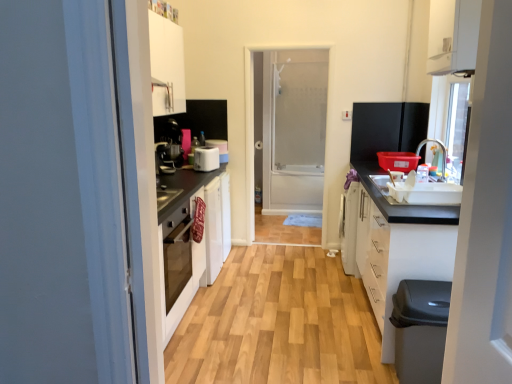
What is the approximate height of wooden floor at center?

2.78 centimeters.

How much space does white matte cabinet at lower right, which appears as the first cabinetry when ordered from the bottom, occupy vertically?

37.04 inches.

What is the approximate width of transparent glass screen door at center?

The width of transparent glass screen door at center is 7.07 inches.

The image size is (512, 384). Describe the element at coordinates (420, 329) in the screenshot. I see `black plastic dishwasher at lower right` at that location.

Locate an element on the screen. This screenshot has height=384, width=512. white plastic toaster at center is located at coordinates (206, 158).

Which is closer to the camera, (380, 318) or (431, 22)?

Point (380, 318) is positioned farther from the camera compared to point (431, 22).

Based on the photo, from the image's perspective, is white matte cabinet at lower right, acting as the second cabinetry starting from the top, under white glossy cabinet at upper right, which is counted as the 2th cabinetry, starting from the bottom?

Yes, from the image's perspective, white matte cabinet at lower right, acting as the second cabinetry starting from the top, is below white glossy cabinet at upper right, which is counted as the 2th cabinetry, starting from the bottom.

This screenshot has height=384, width=512. In order to click on cabinetry that is above the white matte cabinet at lower right, acting as the second cabinetry starting from the top (from the image's perspective) in this screenshot , I will do `click(453, 35)`.

Locate an element on the screen. The image size is (512, 384). cabinetry that is above the matte black coffee machine at center-left (from a real-world perspective) is located at coordinates (453, 35).

Can you confirm if white glossy cabinet at upper right, marked as the first cabinetry in a top-to-bottom arrangement, is positioned to the right of matte black coffee machine at center-left?

Correct, you'll find white glossy cabinet at upper right, marked as the first cabinetry in a top-to-bottom arrangement, to the right of matte black coffee machine at center-left.

Is matte black coffee machine at center-left located within white glossy cabinet at upper right, marked as the first cabinetry in a top-to-bottom arrangement?

No, matte black coffee machine at center-left is not surrounded by white glossy cabinet at upper right, marked as the first cabinetry in a top-to-bottom arrangement.

From the image's perspective, which object appears higher, white plastic toaster at center or wooden floor at center?

white plastic toaster at center.

Is white plastic toaster at center in front of wooden floor at center?

No, it is not.

Would you say white plastic toaster at center is a long distance from wooden floor at center?

That's right, there is a large distance between white plastic toaster at center and wooden floor at center.

How different are the orientations of white plastic toaster at center and wooden floor at center in degrees?

There is a 73.3-degree angle between the facing directions of white plastic toaster at center and wooden floor at center.

From a real-world perspective, is transparent glass screen door at center below white glossy cabinet at upper right, marked as the first cabinetry in a top-to-bottom arrangement?

Yes, from a real-world perspective, transparent glass screen door at center is under white glossy cabinet at upper right, marked as the first cabinetry in a top-to-bottom arrangement.

Would you say transparent glass screen door at center is a long distance from white glossy cabinet at upper right, marked as the first cabinetry in a top-to-bottom arrangement?

Yes.

Is transparent glass screen door at center positioned with its back to white glossy cabinet at upper right, marked as the first cabinetry in a top-to-bottom arrangement?

No, transparent glass screen door at center is not facing the opposite direction of white glossy cabinet at upper right, marked as the first cabinetry in a top-to-bottom arrangement.

Considering the positions of objects transparent glass screen door at center and white glossy cabinet at upper right, which is counted as the 2th cabinetry, starting from the bottom, in the image provided, who is in front, transparent glass screen door at center or white glossy cabinet at upper right, which is counted as the 2th cabinetry, starting from the bottom,?

white glossy cabinet at upper right, which is counted as the 2th cabinetry, starting from the bottom.

Looking at their sizes, would you say white plastic toaster at center is wider or thinner than white matte cabinet at lower right, acting as the second cabinetry starting from the top?

Considering their sizes, white plastic toaster at center looks slimmer than white matte cabinet at lower right, acting as the second cabinetry starting from the top.

Is white plastic toaster at center at the right side of white matte cabinet at lower right, acting as the second cabinetry starting from the top?

Incorrect, white plastic toaster at center is not on the right side of white matte cabinet at lower right, acting as the second cabinetry starting from the top.

Is point (205, 156) closer or farther from the camera than point (425, 218)?

Point (205, 156) is farther from the camera than point (425, 218).

Is point (199, 160) positioned in front of point (474, 18)?

That is False.

From the image's perspective, is white plastic toaster at center below white glossy cabinet at upper right, marked as the first cabinetry in a top-to-bottom arrangement?

Yes, from the image's perspective, white plastic toaster at center is below white glossy cabinet at upper right, marked as the first cabinetry in a top-to-bottom arrangement.

Considering the sizes of objects white plastic toaster at center and white glossy cabinet at upper right, which is counted as the 2th cabinetry, starting from the bottom, in the image provided, who is shorter, white plastic toaster at center or white glossy cabinet at upper right, which is counted as the 2th cabinetry, starting from the bottom,?

With less height is white plastic toaster at center.

Which of these two, white plastic toaster at center or white glossy cabinet at upper right, marked as the first cabinetry in a top-to-bottom arrangement, is wider?

white glossy cabinet at upper right, marked as the first cabinetry in a top-to-bottom arrangement, is wider.

Is matte black coffee machine at center-left shorter than transparent glass screen door at center?

Yes, matte black coffee machine at center-left is shorter than transparent glass screen door at center.

Does matte black coffee machine at center-left have a smaller size compared to transparent glass screen door at center?

Indeed, matte black coffee machine at center-left has a smaller size compared to transparent glass screen door at center.

What's the angular difference between matte black coffee machine at center-left and transparent glass screen door at center's facing directions?

There is a 89.3-degree angle between the facing directions of matte black coffee machine at center-left and transparent glass screen door at center.

Which is more to the right, matte black coffee machine at center-left or transparent glass screen door at center?

transparent glass screen door at center is more to the right.

Locate an element on the screen. cabinetry in front of the white matte cabinet at lower right, which appears as the first cabinetry when ordered from the bottom is located at coordinates (453, 35).

This screenshot has width=512, height=384. I want to click on coffee machine behind the white glossy cabinet at upper right, marked as the first cabinetry in a top-to-bottom arrangement, so click(x=170, y=146).

Considering their positions, is matte black coffee machine at center-left positioned further to wooden floor at center than black plastic dishwasher at lower right?

The object further to wooden floor at center is matte black coffee machine at center-left.

Based on their spatial positions, is white plastic toaster at center or white matte cabinet at lower right, acting as the second cabinetry starting from the top, closer to transparent glass screen door at center?

white plastic toaster at center lies closer to transparent glass screen door at center than the other object.

When comparing their distances from matte black coffee machine at center-left, does black plastic dishwasher at lower right or wooden floor at center seem further?

Based on the image, black plastic dishwasher at lower right appears to be further to matte black coffee machine at center-left.

Estimate the real-world distances between objects in this image. Which object is further from black plastic dishwasher at lower right, wooden floor at center or white glossy cabinet at upper right, marked as the first cabinetry in a top-to-bottom arrangement?

white glossy cabinet at upper right, marked as the first cabinetry in a top-to-bottom arrangement, is positioned further to the anchor black plastic dishwasher at lower right.

Based on their spatial positions, is matte black coffee machine at center-left or white matte cabinet at lower right, acting as the second cabinetry starting from the top, closer to white glossy cabinet at upper right, marked as the first cabinetry in a top-to-bottom arrangement?

white matte cabinet at lower right, acting as the second cabinetry starting from the top, is closer to white glossy cabinet at upper right, marked as the first cabinetry in a top-to-bottom arrangement.

From the image, which object appears to be nearer to transparent glass screen door at center, white glossy cabinet at upper right, marked as the first cabinetry in a top-to-bottom arrangement, or black plastic dishwasher at lower right?

white glossy cabinet at upper right, marked as the first cabinetry in a top-to-bottom arrangement, is positioned closer to the anchor transparent glass screen door at center.

Based on their spatial positions, is black plastic dishwasher at lower right or transparent glass screen door at center further from wooden floor at center?

The object further to wooden floor at center is transparent glass screen door at center.

Considering their positions, is white plastic toaster at center positioned further to white glossy cabinet at upper right, marked as the first cabinetry in a top-to-bottom arrangement, than white matte cabinet at lower right, acting as the second cabinetry starting from the top?

white plastic toaster at center is positioned further to the anchor white glossy cabinet at upper right, marked as the first cabinetry in a top-to-bottom arrangement.

Where is `appliance between black plastic dishwasher at lower right and transparent glass screen door at center from front to back`? This screenshot has height=384, width=512. appliance between black plastic dishwasher at lower right and transparent glass screen door at center from front to back is located at coordinates (206, 158).

Find the location of a particular element. The height and width of the screenshot is (384, 512). appliance between matte black coffee machine at center-left and transparent glass screen door at center is located at coordinates (206, 158).

Where is `cabinetry located between white glossy cabinet at upper right, which is counted as the 2th cabinetry, starting from the bottom, and transparent glass screen door at center in the depth direction`? The width and height of the screenshot is (512, 384). cabinetry located between white glossy cabinet at upper right, which is counted as the 2th cabinetry, starting from the bottom, and transparent glass screen door at center in the depth direction is located at coordinates (400, 247).

This screenshot has height=384, width=512. Find the location of `appliance located between black plastic dishwasher at lower right and matte black coffee machine at center-left in the depth direction`. appliance located between black plastic dishwasher at lower right and matte black coffee machine at center-left in the depth direction is located at coordinates (206, 158).